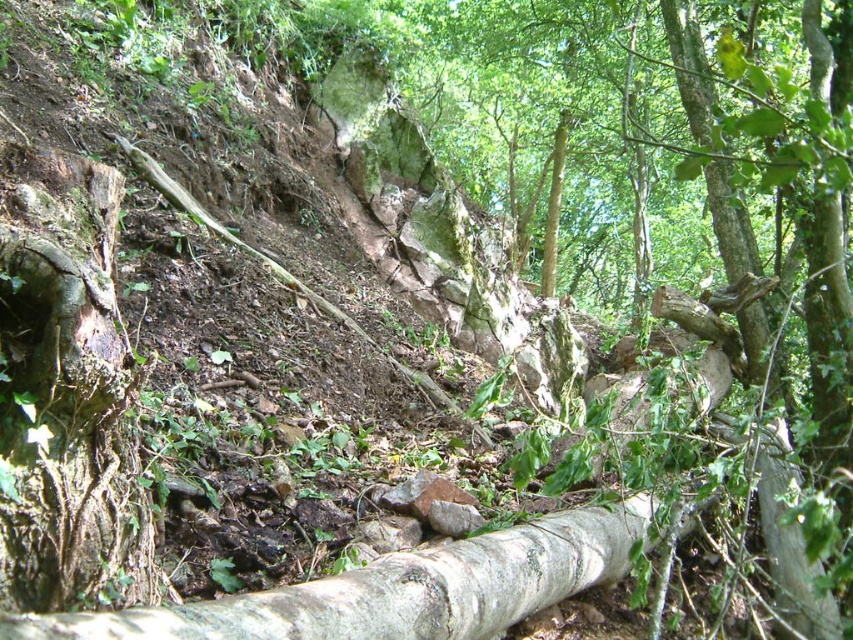
You are a hiker carrying a backpack and need to cross over the brown rough tree trunk at left and the white rough bark log at lower center. Which one is easier to step over based on their sizes?

The brown rough tree trunk at left is smaller than the white rough bark log at lower center, so it would be easier to step over the brown rough tree trunk at left since it is lower and narrower.

You are a hiker trying to cross a stream in the forest. You see the brown rough tree trunk at left and the white rough bark log at lower center. Which one is narrower and might be easier to step over?

The brown rough tree trunk at left is thinner than the white rough bark log at lower center, so it is narrower and easier to step over.

You are a hiker trying to cross the forest floor. You see the brown rough tree trunk at left and the white rough bark log at lower center. Which object is closer to you as you approach from the front of the image?

The brown rough tree trunk at left is closer to you because the white rough bark log at lower center is positioned behind it.